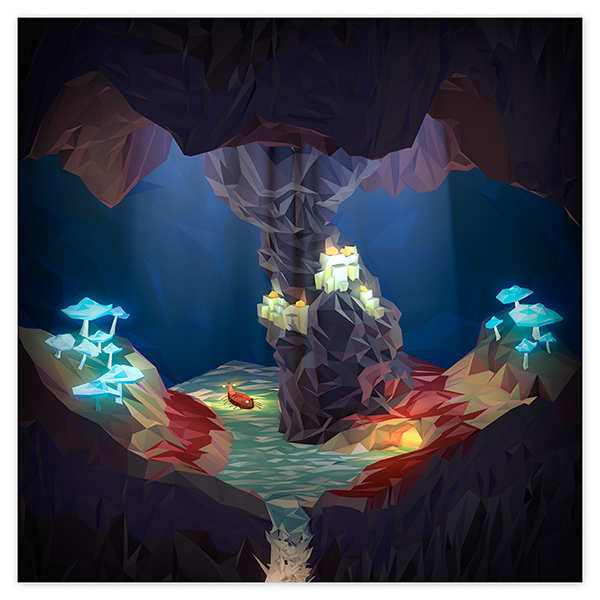
Find the location of `column`. column is located at coordinates (265, 178), (341, 372), (310, 246).